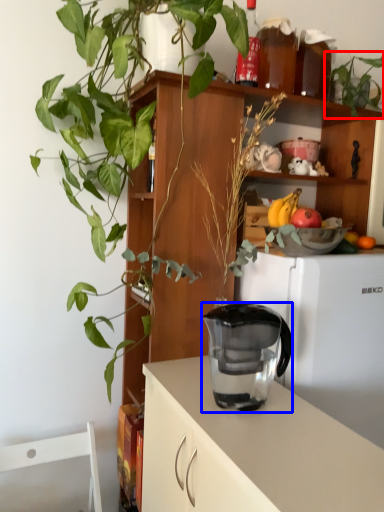
Question: Among these objects, which one is farthest to the camera, houseplant (highlighted by a red box) or jug (highlighted by a blue box)?

Choices:
 (A) houseplant
 (B) jug

Answer: (A)